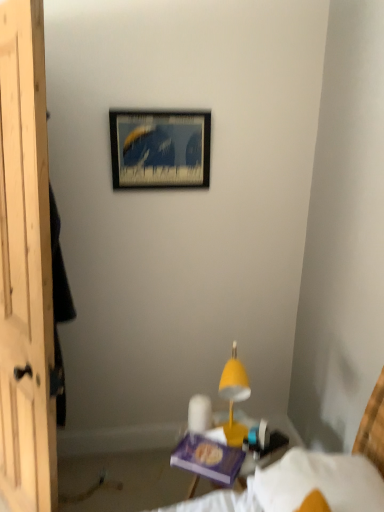
Question: From a real-world perspective, is yellow matte table lamp at center located beneath wooden picture frame at upper center?

Choices:
 (A) yes
 (B) no

Answer: (A)

Question: From the image's perspective, is yellow matte table lamp at center below wooden picture frame at upper center?

Choices:
 (A) yes
 (B) no

Answer: (A)

Question: Is yellow matte table lamp at center behind wooden picture frame at upper center?

Choices:
 (A) yes
 (B) no

Answer: (B)

Question: Does yellow matte table lamp at center have a smaller size compared to wooden picture frame at upper center?

Choices:
 (A) yes
 (B) no

Answer: (B)

Question: Is yellow matte table lamp at center positioned beyond the bounds of wooden picture frame at upper center?

Choices:
 (A) yes
 (B) no

Answer: (A)

Question: Is yellow matte table lamp at center shorter than wooden picture frame at upper center?

Choices:
 (A) no
 (B) yes

Answer: (A)

Question: Considering the relative positions of yellow matte table lamp at center and white fabric bed at lower right in the image provided, is yellow matte table lamp at center behind white fabric bed at lower right?

Choices:
 (A) yes
 (B) no

Answer: (A)

Question: Is yellow matte table lamp at center taller than white fabric bed at lower right?

Choices:
 (A) no
 (B) yes

Answer: (A)

Question: Is white fabric bed at lower right completely or partially inside yellow matte table lamp at center?

Choices:
 (A) yes
 (B) no

Answer: (B)

Question: From the image's perspective, is yellow matte table lamp at center under white fabric bed at lower right?

Choices:
 (A) yes
 (B) no

Answer: (B)

Question: Is yellow matte table lamp at center in front of white fabric bed at lower right?

Choices:
 (A) no
 (B) yes

Answer: (A)

Question: Is white fabric bed at lower right at the back of yellow matte table lamp at center?

Choices:
 (A) yes
 (B) no

Answer: (B)

Question: Does wooden picture frame at upper center lie behind yellow matte table lamp at center?

Choices:
 (A) no
 (B) yes

Answer: (B)